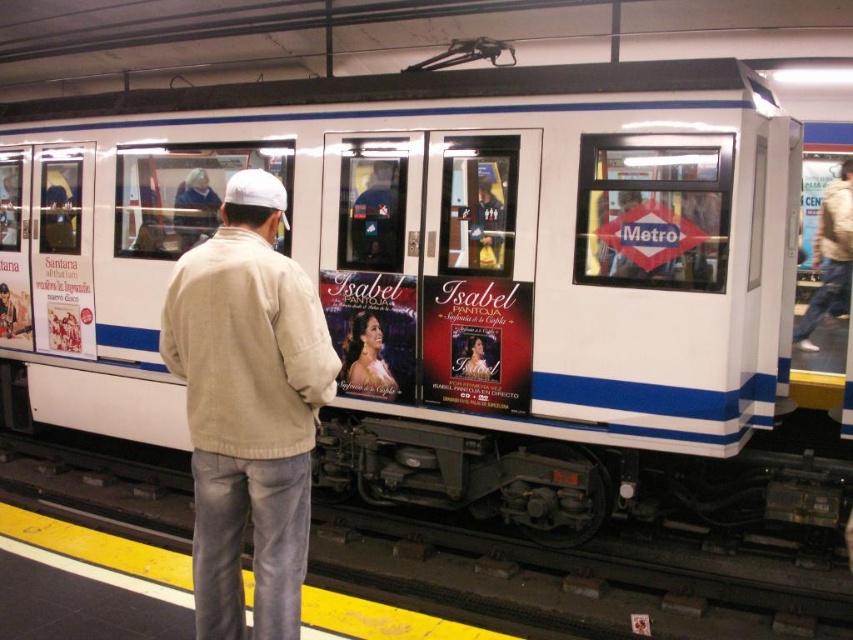
Question: Does light brown jacket at right lie in front of smooth skin woman at center?

Choices:
 (A) no
 (B) yes

Answer: (A)

Question: Is light brown jacket at right positioned in front of light beige jacket at center?

Choices:
 (A) no
 (B) yes

Answer: (A)

Question: Which object is the closest to the smooth skin woman at center?

Choices:
 (A) beige cotton jacket at center
 (B) light brown jacket at right

Answer: (A)

Question: Among these points, which one is nearest to the camera?

Choices:
 (A) (344, 372)
 (B) (184, 193)
 (C) (808, 321)
 (D) (196, 307)

Answer: (D)

Question: Is beige cotton jacket at center thinner than smooth skin woman at center?

Choices:
 (A) no
 (B) yes

Answer: (A)

Question: Which of the following is the closest to the observer?

Choices:
 (A) smooth skin woman at center
 (B) light beige jacket at center

Answer: (A)